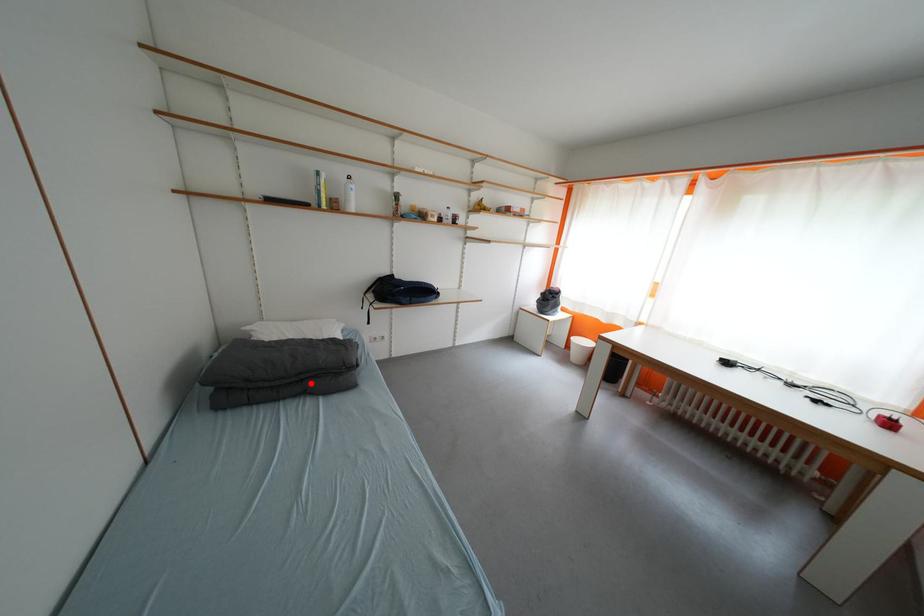
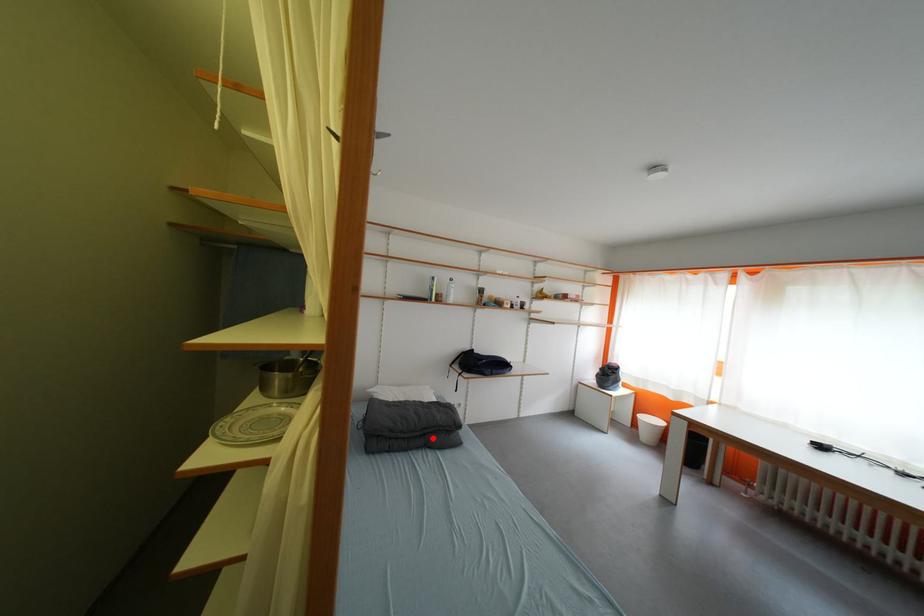
I am providing you with two images of the same scene from different viewpoints. A red point is marked on the first image and another point is marked on the second image. Is the marked point in image1 the same physical position as the marked point in image2?

Yes